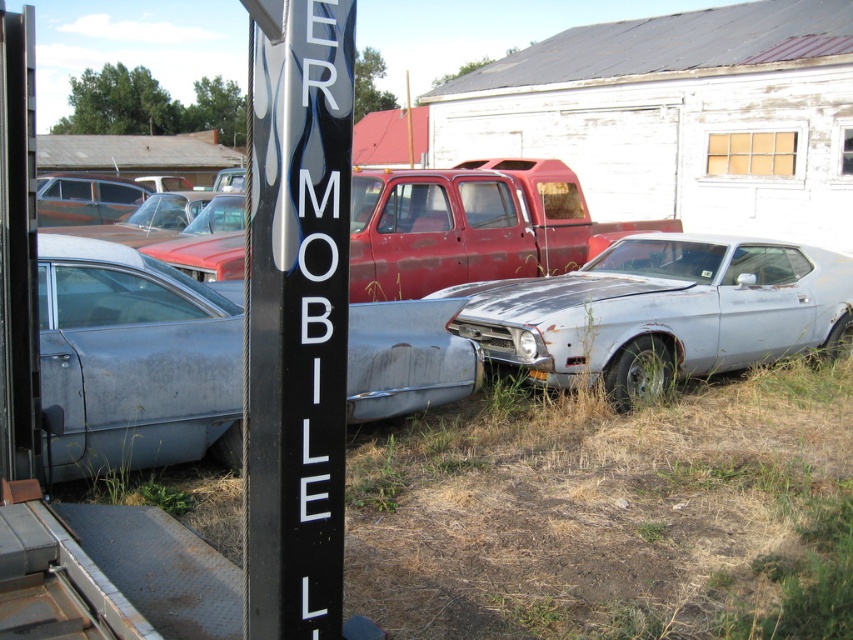
Can you confirm if rusty metallic car at center is smaller than rusty metal pickup truck at center?

Correct, rusty metallic car at center occupies less space than rusty metal pickup truck at center.

Is point (527, 355) positioned after point (216, 278)?

That is False.

Is point (786, 257) closer to viewer compared to point (376, 189)?

That is True.

The image size is (853, 640). I want to click on rusty metallic car at center, so click(663, 312).

Can you confirm if black plastic sign at center is taller than rusty metal car at left?

Yes.

Is black plastic sign at center closer to the viewer compared to rusty metal car at left?

Yes, black plastic sign at center is in front of rusty metal car at left.

Who is more forward, (331, 337) or (129, 225)?

Positioned in front is point (331, 337).

Where is `black plastic sign at center`? black plastic sign at center is located at coordinates (296, 314).

Find the location of `black plastic sign at center`. black plastic sign at center is located at coordinates pyautogui.click(x=296, y=314).

Can you confirm if black plastic sign at center is positioned to the right of rusty metal car at center?

Correct, you'll find black plastic sign at center to the right of rusty metal car at center.

Between point (291, 97) and point (158, 340), which one is positioned behind?

The point (158, 340) is more distant.

Where is `black plastic sign at center`? black plastic sign at center is located at coordinates (296, 314).